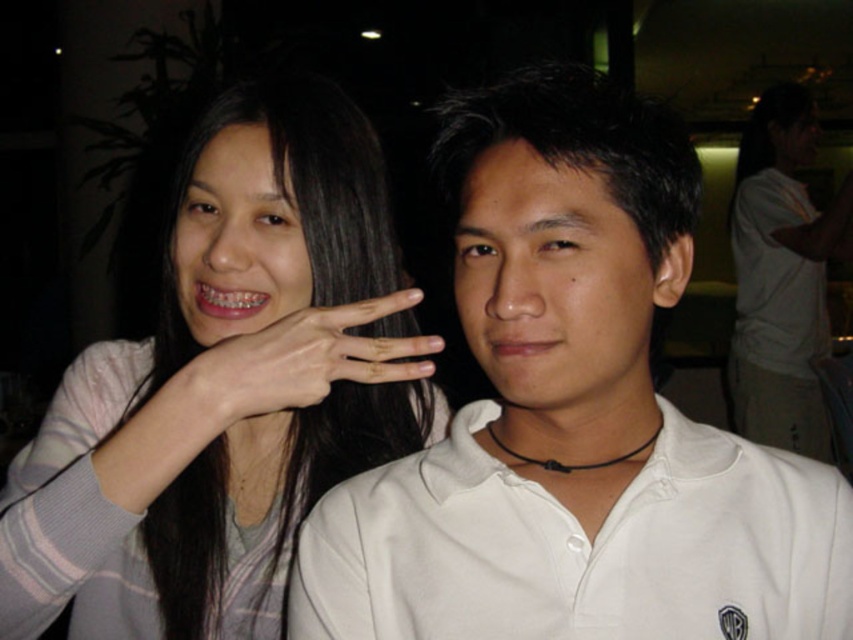
Does white matte shirt at center have a smaller size compared to pink striped sweater at upper left?

Yes.

Is white matte shirt at center below pink striped sweater at upper left?

No, white matte shirt at center is not below pink striped sweater at upper left.

The height and width of the screenshot is (640, 853). What do you see at coordinates (573, 419) in the screenshot?
I see `white matte shirt at center` at bounding box center [573, 419].

Locate an element on the screen. The width and height of the screenshot is (853, 640). white matte shirt at center is located at coordinates (573, 419).

Does white cotton shirt at center have a lesser width compared to white matte shirt at upper right?

Yes.

Does white cotton shirt at center have a smaller size compared to white matte shirt at upper right?

Yes.

Which is behind, point (810, 602) or point (811, 376)?

The point (811, 376) is behind.

At what (x,y) coordinates should I click in order to perform the action: click on white cotton shirt at center. Please return your answer as a coordinate pair (x, y). Looking at the image, I should click on (579, 547).

Does white cotton shirt at center appear on the left side of light skin tone finger at center?

In fact, white cotton shirt at center is to the right of light skin tone finger at center.

Between point (601, 624) and point (403, 376), which one is positioned in front?

Point (601, 624) is in front.

The height and width of the screenshot is (640, 853). I want to click on white cotton shirt at center, so click(x=579, y=547).